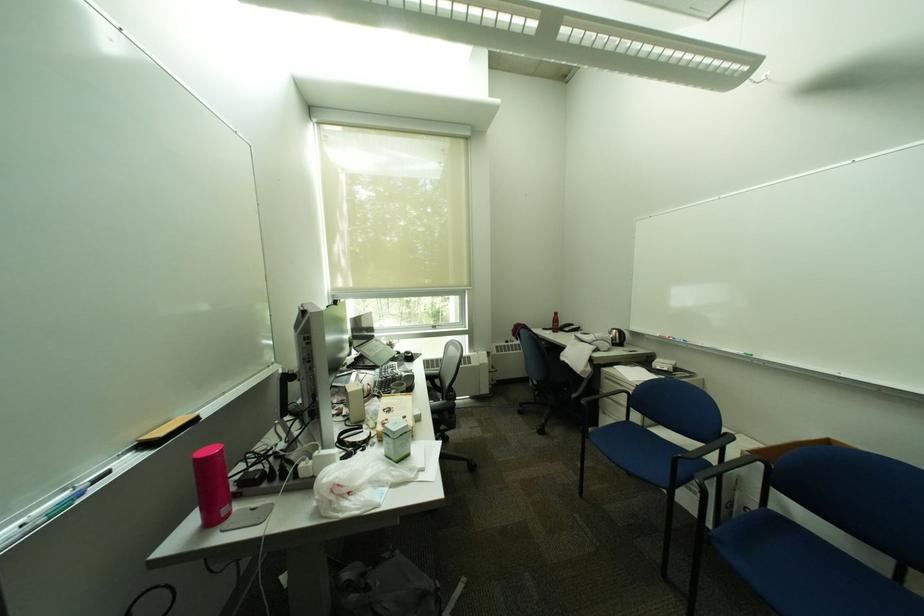
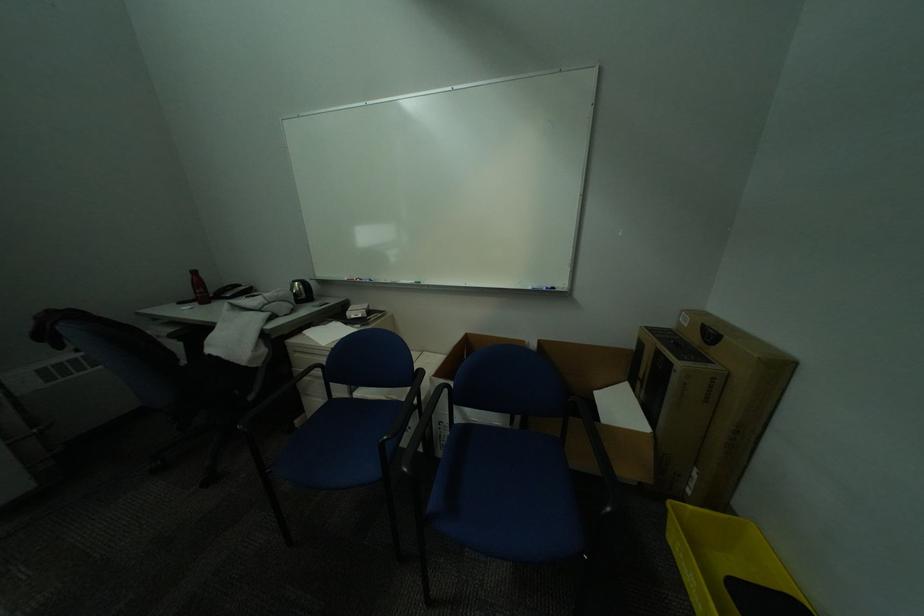
Find the pixel in the second image that matches pixel 623 341 in the first image.

(307, 296)